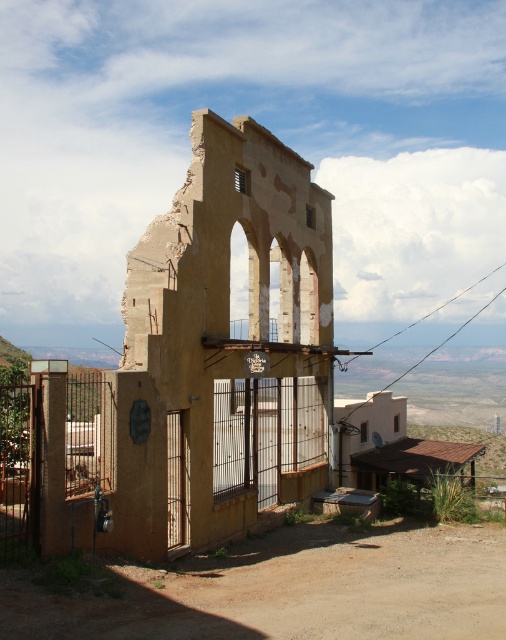
Question: Does yellow stucco ruins at center appear on the right side of brown wooden gate at left?

Choices:
 (A) no
 (B) yes

Answer: (B)

Question: Is rusty metal gate at lower left above brown wooden gate at left?

Choices:
 (A) no
 (B) yes

Answer: (A)

Question: Which point is farther from the camera taking this photo?

Choices:
 (A) (272, 438)
 (B) (3, 465)
 (C) (195, 260)

Answer: (A)

Question: Can you confirm if yellow stucco ruins at center is wider than brown wooden gate at left?

Choices:
 (A) yes
 (B) no

Answer: (A)

Question: Which object appears farthest from the camera in this image?

Choices:
 (A) rusty metal gate at lower left
 (B) brown wooden gate at left
 (C) yellow stucco ruins at center

Answer: (C)

Question: Considering the real-world distances, which object is farthest from the brown wooden gate at left?

Choices:
 (A) yellow stucco ruins at center
 (B) rusty metal gate at lower left

Answer: (A)